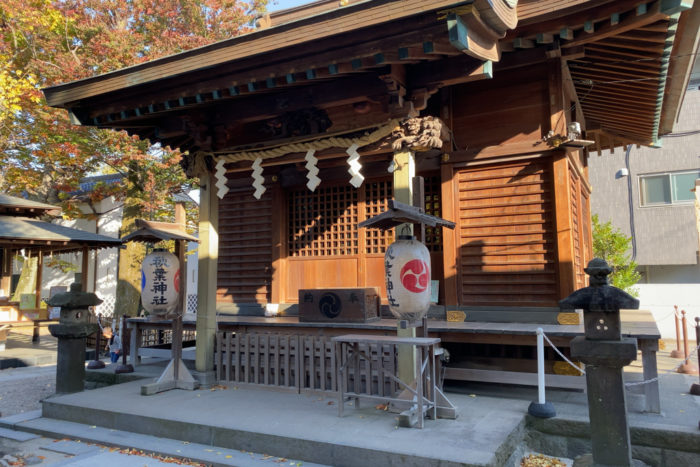
The height and width of the screenshot is (467, 700). I want to click on windows, so click(x=682, y=190), click(x=656, y=190).